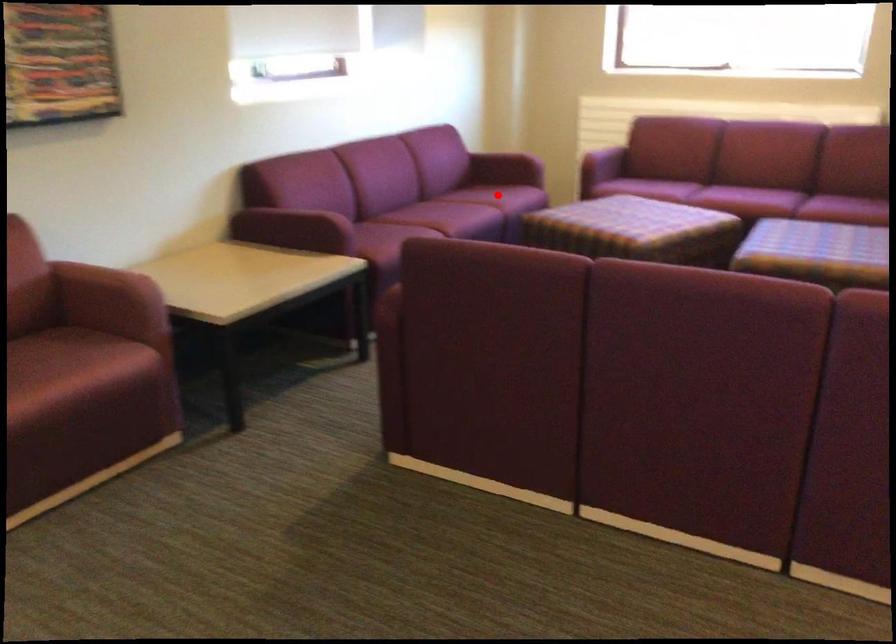
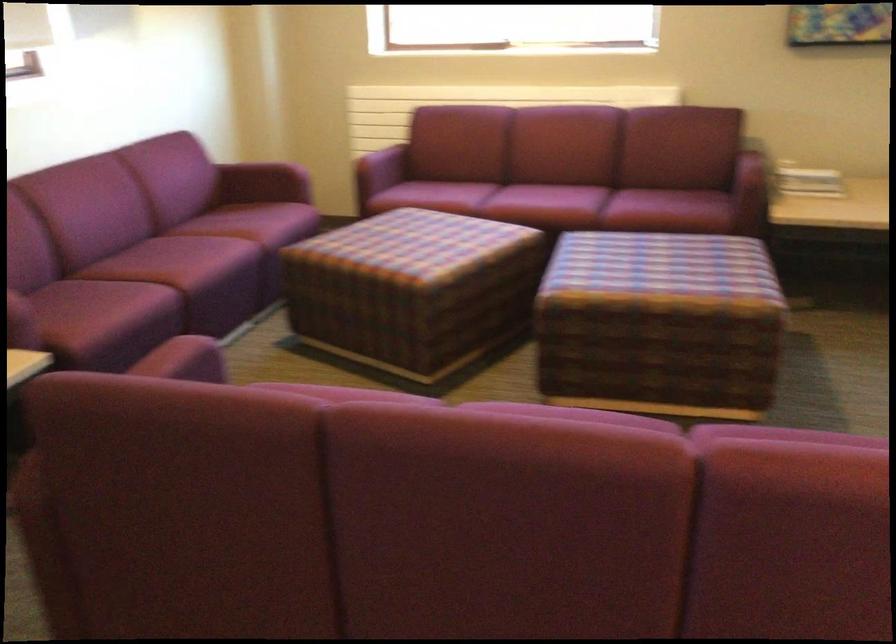
Question: I am providing you with two images of the same scene from different viewpoints. A red point is shown in image1. For the corresponding object point in image2, is it positioned nearer or farther from the camera?

Choices:
 (A) Nearer
 (B) Farther

Answer: (A)